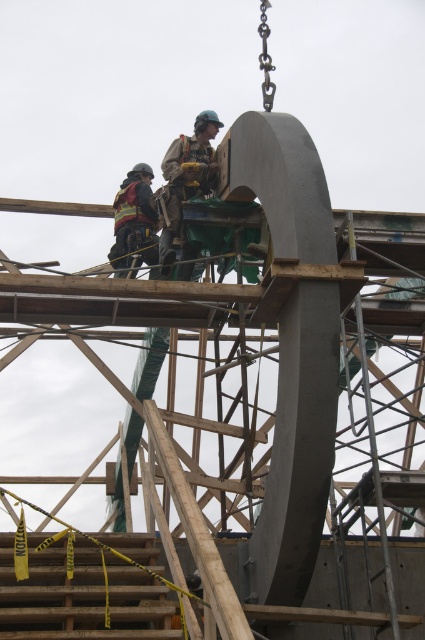
Question: Among these points, which one is nearest to the camera?

Choices:
 (A) (x=119, y=257)
 (B) (x=197, y=195)

Answer: (B)

Question: Is camouflage fabric safety vest at center thinner than reflective safety vest at left?

Choices:
 (A) yes
 (B) no

Answer: (B)

Question: Does camouflage fabric safety vest at center appear over reflective safety vest at left?

Choices:
 (A) yes
 (B) no

Answer: (A)

Question: Which object is farther from the camera taking this photo?

Choices:
 (A) camouflage fabric safety vest at center
 (B) reflective safety vest at left

Answer: (B)

Question: Is camouflage fabric safety vest at center above reflective safety vest at left?

Choices:
 (A) yes
 (B) no

Answer: (A)